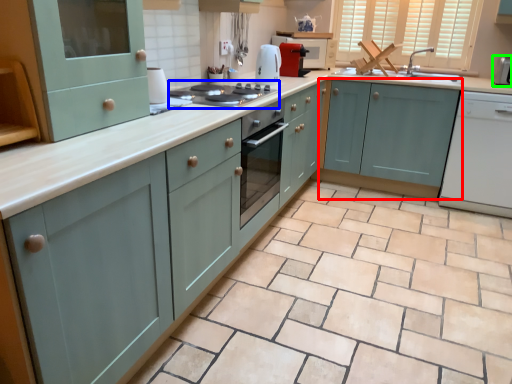
Question: Based on their relative distances, which object is nearer to cabinetry (highlighted by a red box)? Choose from kitchen appliance (highlighted by a blue box) and appliance (highlighted by a green box).

Choices:
 (A) kitchen appliance
 (B) appliance

Answer: (B)